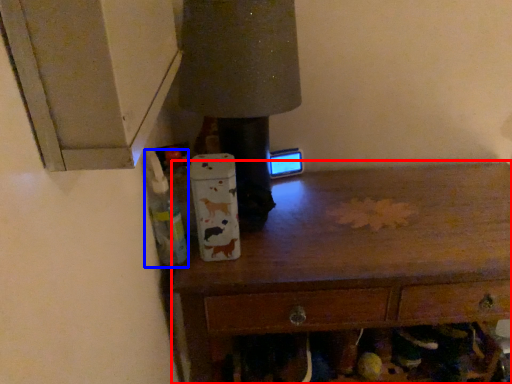
Question: Which of the following is the farthest to the observer, chest of drawers (highlighted by a red box) or bottle (highlighted by a blue box)?

Choices:
 (A) chest of drawers
 (B) bottle

Answer: (A)